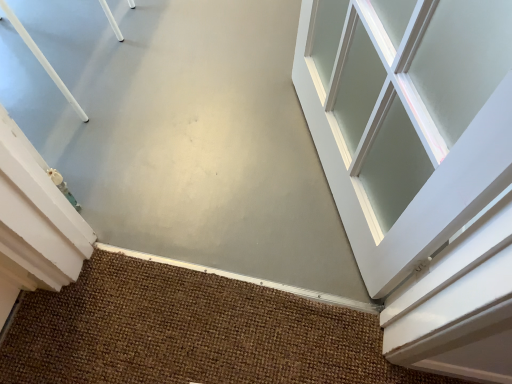
Describe the element at coordinates (189, 332) in the screenshot. Image resolution: width=512 pixels, height=384 pixels. I see `brown woven mat at lower center` at that location.

Identify the location of brown woven mat at lower center. coord(189,332).

What is the approximate height of brown woven mat at lower center?

2.21 inches.

In order to click on brown woven mat at lower center in this screenshot , I will do `click(189, 332)`.